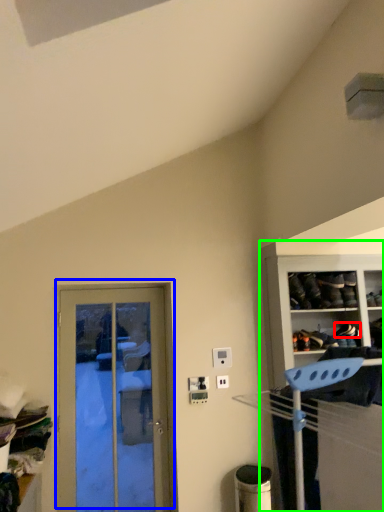
Question: Estimate the real-world distances between objects in this image. Which object is farther from shoe (highlighted by a red box), door (highlighted by a blue box) or cabinetry (highlighted by a green box)?

Choices:
 (A) door
 (B) cabinetry

Answer: (A)